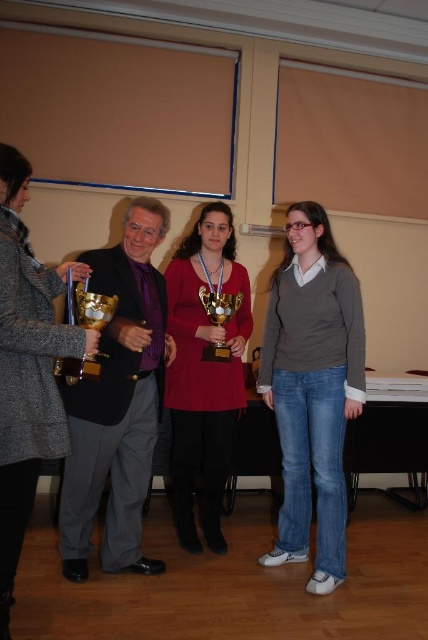
Between shiny black suit at center and matte gold trophy at center, which one appears on the left side from the viewer's perspective?

Positioned to the left is shiny black suit at center.

Is shiny black suit at center positioned in front of matte gold trophy at center?

Yes, it is.

Describe the element at coordinates (118, 403) in the screenshot. Image resolution: width=428 pixels, height=640 pixels. I see `shiny black suit at center` at that location.

The width and height of the screenshot is (428, 640). Identify the location of shiny black suit at center. (118, 403).

Which is in front, point (65, 385) or point (50, 396)?

Point (50, 396)

Is shiny black suit at center wider than gray wool coat at left?

Correct, the width of shiny black suit at center exceeds that of gray wool coat at left.

Between point (110, 388) and point (26, 371), which one is positioned in front?

Point (26, 371)

This screenshot has width=428, height=640. Identify the location of shiny black suit at center. (118, 403).

Can you confirm if matte gray sweater at center is positioned to the right of gray wool coat at left?

Correct, you'll find matte gray sweater at center to the right of gray wool coat at left.

Measure the distance from matte gray sweater at center to gray wool coat at left.

matte gray sweater at center and gray wool coat at left are 4.10 feet apart from each other.

This screenshot has height=640, width=428. I want to click on matte gray sweater at center, so click(312, 388).